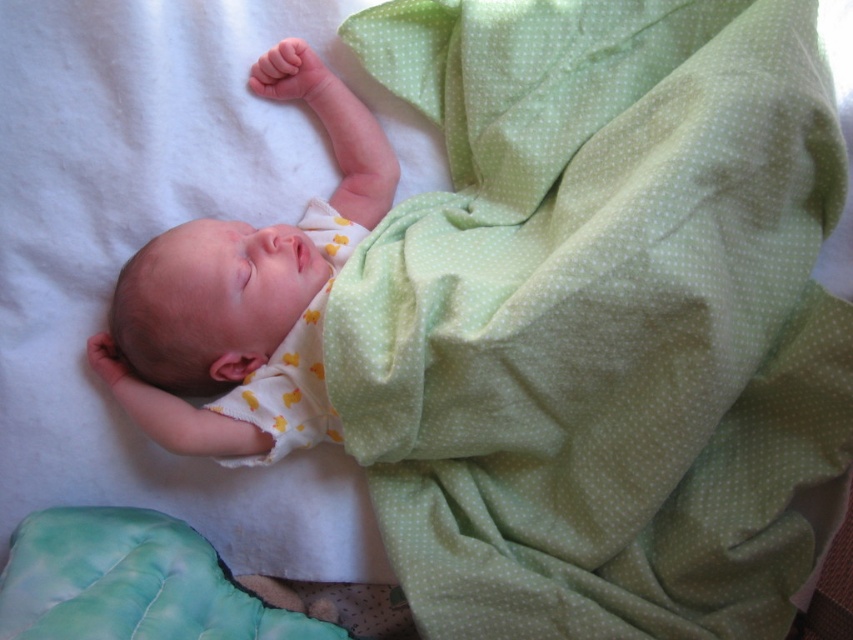
Is soft yellow fabric at center above yellow dotted fabric at center?

Yes, soft yellow fabric at center is above yellow dotted fabric at center.

Is soft yellow fabric at center positioned behind yellow dotted fabric at center?

That is False.

Image resolution: width=853 pixels, height=640 pixels. I want to click on soft yellow fabric at center, so click(x=248, y=296).

The image size is (853, 640). Find the location of `soft yellow fabric at center`. soft yellow fabric at center is located at coordinates (248, 296).